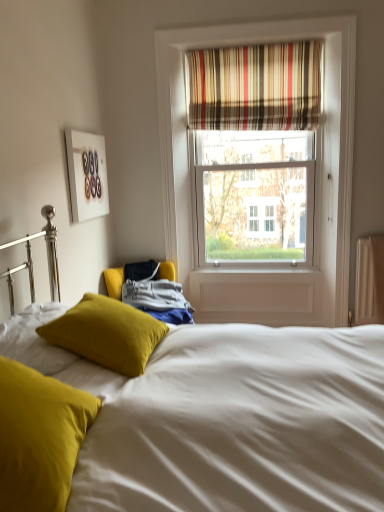
Question: Does velvet mustard pillow at center, which is the 2th pillow from front to back, have a greater width compared to striped fabric curtain at upper center?

Choices:
 (A) yes
 (B) no

Answer: (A)

Question: From a real-world perspective, is velvet mustard pillow at center, positioned as the 1th pillow in back-to-front order, physically above striped fabric curtain at upper center?

Choices:
 (A) yes
 (B) no

Answer: (B)

Question: Is velvet mustard pillow at center, positioned as the 1th pillow in back-to-front order, closer to camera compared to striped fabric curtain at upper center?

Choices:
 (A) no
 (B) yes

Answer: (B)

Question: Can you confirm if velvet mustard pillow at center, positioned as the 1th pillow in back-to-front order, is positioned to the right of striped fabric curtain at upper center?

Choices:
 (A) yes
 (B) no

Answer: (B)

Question: Is velvet mustard pillow at center, which is the 2th pillow from front to back, turned away from striped fabric curtain at upper center?

Choices:
 (A) no
 (B) yes

Answer: (A)

Question: Do you think velvet mustard pillow at center, which is the 2th pillow from front to back, is within matte yellow pillow at lower left, the 2th pillow in the back-to-front sequence, or outside of it?

Choices:
 (A) outside
 (B) inside

Answer: (A)

Question: In the image, is velvet mustard pillow at center, which is the 2th pillow from front to back, positioned in front of or behind matte yellow pillow at lower left, the first pillow when ordered from front to back?

Choices:
 (A) behind
 (B) front

Answer: (A)

Question: Is velvet mustard pillow at center, which is the 2th pillow from front to back, bigger or smaller than matte yellow pillow at lower left, the first pillow when ordered from front to back?

Choices:
 (A) big
 (B) small

Answer: (A)

Question: From the image's perspective, relative to matte yellow pillow at lower left, the 2th pillow in the back-to-front sequence, is velvet mustard pillow at center, positioned as the 1th pillow in back-to-front order, above or below?

Choices:
 (A) below
 (B) above

Answer: (B)

Question: In terms of height, does velvet mustard pillow at center, which is the 2th pillow from front to back, look taller or shorter compared to white matte picture frame at upper left?

Choices:
 (A) tall
 (B) short

Answer: (B)

Question: Is point (56, 338) positioned closer to the camera than point (77, 202)?

Choices:
 (A) farther
 (B) closer

Answer: (B)

Question: Is velvet mustard pillow at center, positioned as the 1th pillow in back-to-front order, to the left or to the right of white matte picture frame at upper left in the image?

Choices:
 (A) right
 (B) left

Answer: (A)

Question: Looking at their shapes, would you say velvet mustard pillow at center, which is the 2th pillow from front to back, is wider or thinner than white matte picture frame at upper left?

Choices:
 (A) wide
 (B) thin

Answer: (A)

Question: Is matte yellow pillow at lower left, the 2th pillow in the back-to-front sequence, inside or outside of striped fabric curtain at upper center?

Choices:
 (A) outside
 (B) inside

Answer: (A)

Question: Is point (41, 382) closer or farther from the camera than point (274, 75)?

Choices:
 (A) farther
 (B) closer

Answer: (B)